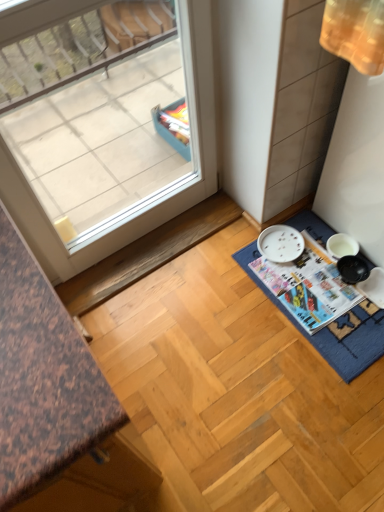
You are a GUI agent. You are given a task and a screenshot of the screen. Output one action in this format:
    pyautogui.click(x=<x>, y=<y>)
    Task: Click on the free spot to the left of blue fabric bath mat at lower right
    
    Given the screenshot: What is the action you would take?
    pyautogui.click(x=208, y=328)